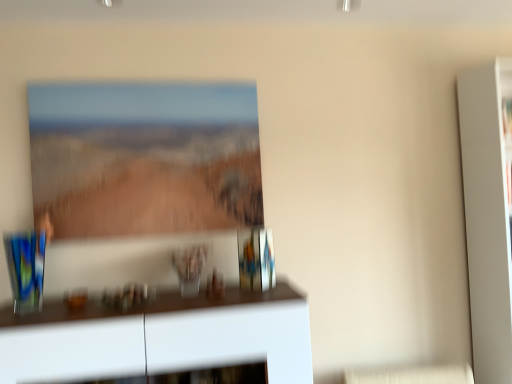
Question: Does matte glass picture frame at upper center have a larger size compared to white glossy cabinet at lower center?

Choices:
 (A) yes
 (B) no

Answer: (B)

Question: From a real-world perspective, is matte glass picture frame at upper center under white glossy cabinet at lower center?

Choices:
 (A) yes
 (B) no

Answer: (B)

Question: Is matte glass picture frame at upper center shorter than white glossy cabinet at lower center?

Choices:
 (A) no
 (B) yes

Answer: (A)

Question: Does matte glass picture frame at upper center have a greater height compared to white glossy cabinet at lower center?

Choices:
 (A) yes
 (B) no

Answer: (A)

Question: Does matte glass picture frame at upper center turn towards white glossy cabinet at lower center?

Choices:
 (A) yes
 (B) no

Answer: (B)

Question: Is matte glass picture frame at upper center positioned behind white glossy cabinet at lower center?

Choices:
 (A) no
 (B) yes

Answer: (B)

Question: From a real-world perspective, is matte glass picture frame at upper center physically below translucent glass vase at center?

Choices:
 (A) no
 (B) yes

Answer: (A)

Question: Would you say matte glass picture frame at upper center contains translucent glass vase at center?

Choices:
 (A) no
 (B) yes

Answer: (A)

Question: Considering the relative sizes of matte glass picture frame at upper center and translucent glass vase at center in the image provided, is matte glass picture frame at upper center taller than translucent glass vase at center?

Choices:
 (A) yes
 (B) no

Answer: (A)

Question: Can you confirm if matte glass picture frame at upper center is smaller than translucent glass vase at center?

Choices:
 (A) no
 (B) yes

Answer: (A)

Question: Is matte glass picture frame at upper center closer to the viewer compared to translucent glass vase at center?

Choices:
 (A) no
 (B) yes

Answer: (A)

Question: Can you confirm if matte glass picture frame at upper center is positioned to the right of translucent glass vase at center?

Choices:
 (A) yes
 (B) no

Answer: (B)

Question: Is white glossy cabinet at lower center thinner than translucent glass vase at center?

Choices:
 (A) no
 (B) yes

Answer: (A)